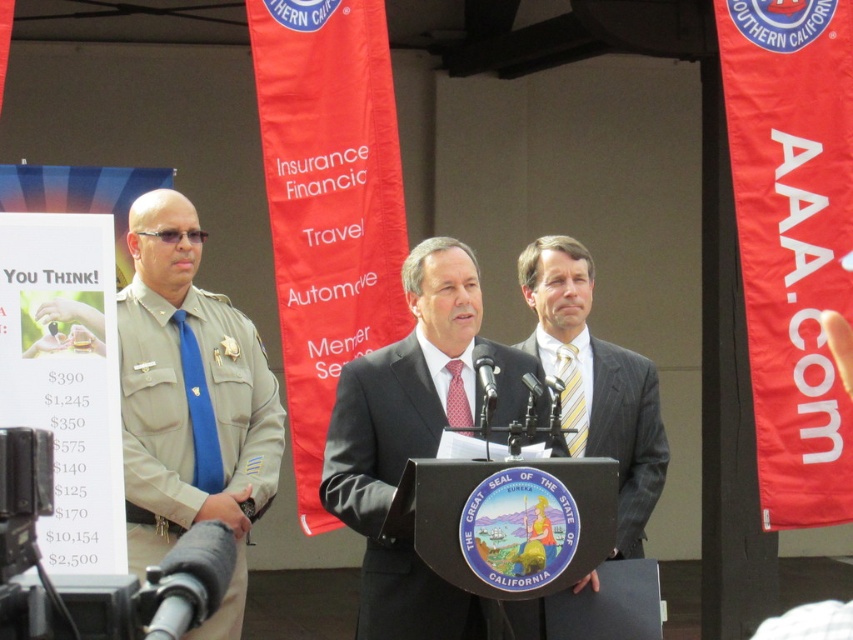
Question: Which of these objects is positioned farthest from the blue silk tie at left?

Choices:
 (A) tan uniform at left
 (B) matte black suit at center

Answer: (B)

Question: Can you confirm if matte black suit at center is positioned below striped yellow tie at center?

Choices:
 (A) yes
 (B) no

Answer: (A)

Question: Which object is farther from the camera taking this photo?

Choices:
 (A) yellow striped tie at center
 (B) blue silk tie at left
 (C) tan uniform at left
 (D) matte black suit at center

Answer: (A)

Question: Can you confirm if blue silk tie at left is bigger than red dotted tie at center?

Choices:
 (A) no
 (B) yes

Answer: (B)

Question: Which point is farther to the camera?

Choices:
 (A) (581, 417)
 (B) (590, 268)

Answer: (B)

Question: Is blue silk tie at left to the left of yellow striped tie at center from the viewer's perspective?

Choices:
 (A) yes
 (B) no

Answer: (A)